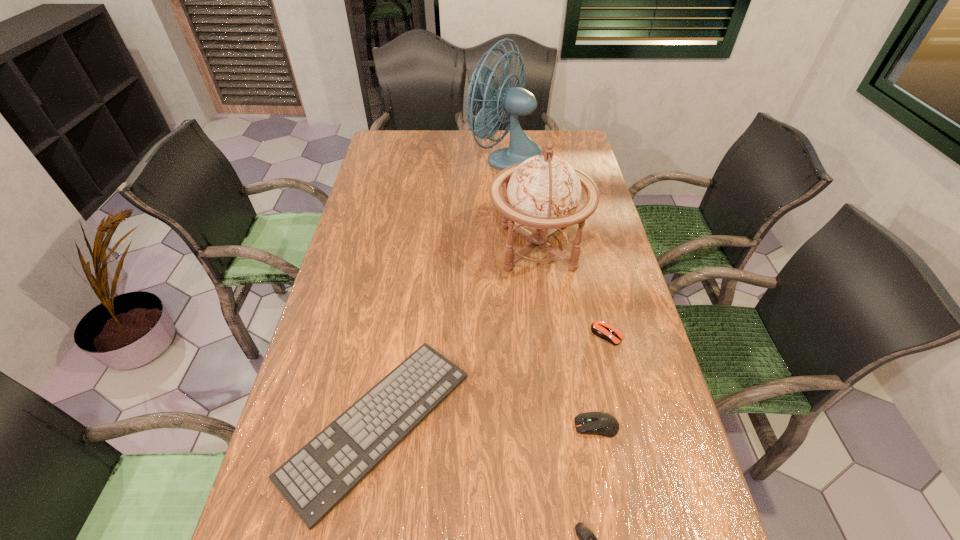
I want to click on the farthest object, so click(x=513, y=101).

Where is `the tallest object`? This screenshot has width=960, height=540. the tallest object is located at coordinates click(x=513, y=101).

Locate an element on the screen. the fifth shortest object is located at coordinates (543, 192).

Identify the location of globe. (543, 192).

The height and width of the screenshot is (540, 960). Identify the location of the fourth shortest object. (604, 424).

This screenshot has width=960, height=540. What are the coordinates of `the second nearest mouse` in the screenshot? It's located at (604, 424).

The width and height of the screenshot is (960, 540). What are the coordinates of `computer keyboard` in the screenshot? It's located at (316, 478).

The height and width of the screenshot is (540, 960). I want to click on the second shortest mouse, so click(x=601, y=329).

Where is `free space located in front of the tallest object to blow air`? free space located in front of the tallest object to blow air is located at coordinates (431, 158).

Identify the location of vacant space located in front of the tallest object to blow air. The width and height of the screenshot is (960, 540). (426, 158).